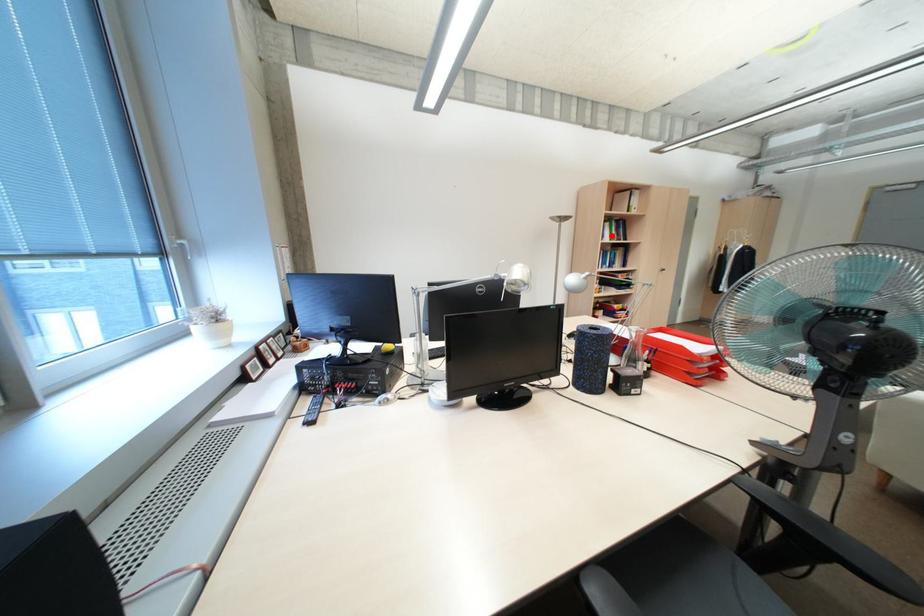
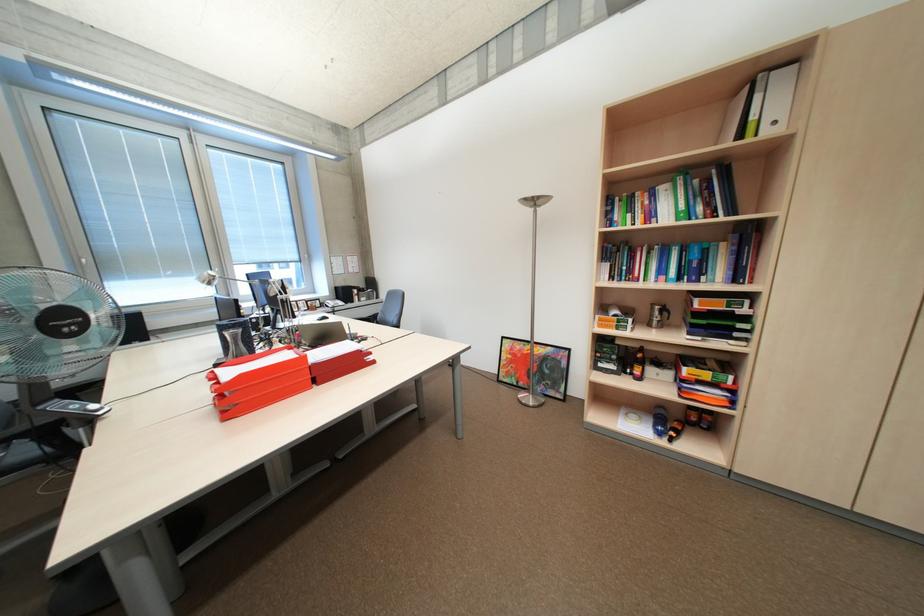
Locate, in the second image, the point that corresponds to the highlighted location in the first image.

(661, 215)